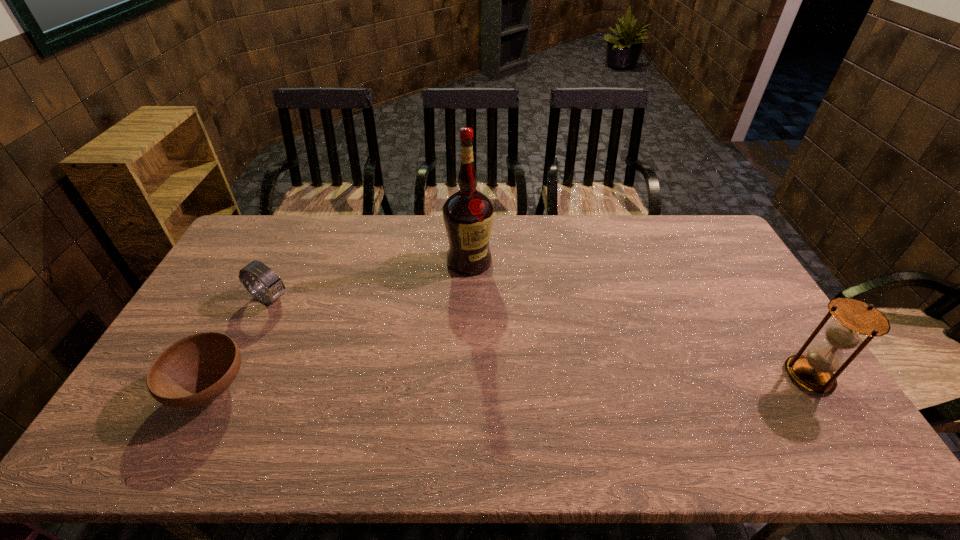
The height and width of the screenshot is (540, 960). I want to click on vacant region located on the label of the third object from left to right, so click(x=459, y=310).

At what (x,y) coordinates should I click in order to perform the action: click on free space located 0.220m on the label of the third object from left to right. Please return your answer as a coordinate pair (x, y). This screenshot has height=540, width=960. Looking at the image, I should click on (455, 327).

This screenshot has height=540, width=960. What are the coordinates of `free region located 0.280m on the face of the watch` in the screenshot? It's located at (356, 338).

Find the location of a particular element. free space located on the face of the watch is located at coordinates (313, 317).

Find the location of a particular element. vacant space located 0.210m on the face of the watch is located at coordinates (338, 329).

Identify the location of object that is positioned at the far edge. (468, 215).

This screenshot has height=540, width=960. In order to click on bowl at the near edge in this screenshot , I will do tap(197, 369).

The image size is (960, 540). Find the location of `hourglass that is at the near edge`. hourglass that is at the near edge is located at coordinates (814, 371).

What are the coordinates of `bowl located in the left edge section of the desktop` in the screenshot? It's located at (197, 369).

Where is `watch that is at the left edge`? This screenshot has width=960, height=540. watch that is at the left edge is located at coordinates (274, 287).